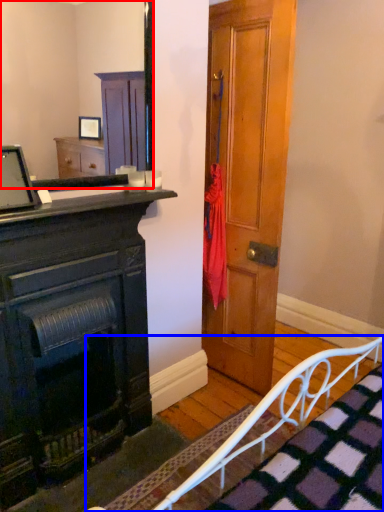
Question: Which object appears farthest to the camera in this image, mirror (highlighted by a red box) or bed frame (highlighted by a blue box)?

Choices:
 (A) mirror
 (B) bed frame

Answer: (A)